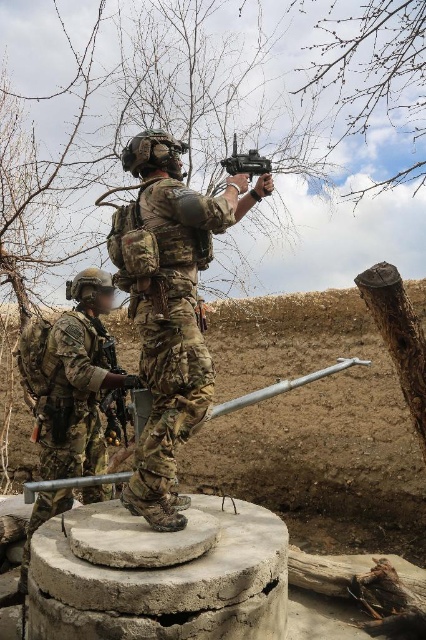
Which is more to the right, camouflage uniform at center or matte black rifle at upper center?

Positioned to the right is matte black rifle at upper center.

Is camouflage uniform at center above matte black rifle at upper center?

No, camouflage uniform at center is not above matte black rifle at upper center.

Between point (72, 340) and point (253, 157), which one is positioned behind?

The point (72, 340) is behind.

The width and height of the screenshot is (426, 640). In order to click on camouflage uniform at center in this screenshot , I will do `click(71, 378)`.

Is camouflage fabric uniform at center to the right of camouflage uniform at center from the viewer's perspective?

Yes, camouflage fabric uniform at center is to the right of camouflage uniform at center.

Is camouflage fabric uniform at center smaller than camouflage uniform at center?

Yes.

Is point (204, 406) positioned before point (89, 348)?

Yes, point (204, 406) is in front of point (89, 348).

Identify the location of camouflage fabric uniform at center. This screenshot has height=640, width=426. (169, 305).

Which is more to the right, camouflage fabric uniform at center or matte black rifle at upper center?

matte black rifle at upper center

Does camouflage fabric uniform at center have a lesser height compared to matte black rifle at upper center?

No, camouflage fabric uniform at center is not shorter than matte black rifle at upper center.

What do you see at coordinates (169, 305) in the screenshot? I see `camouflage fabric uniform at center` at bounding box center [169, 305].

Find the location of a particular element. The width and height of the screenshot is (426, 640). camouflage fabric uniform at center is located at coordinates (169, 305).